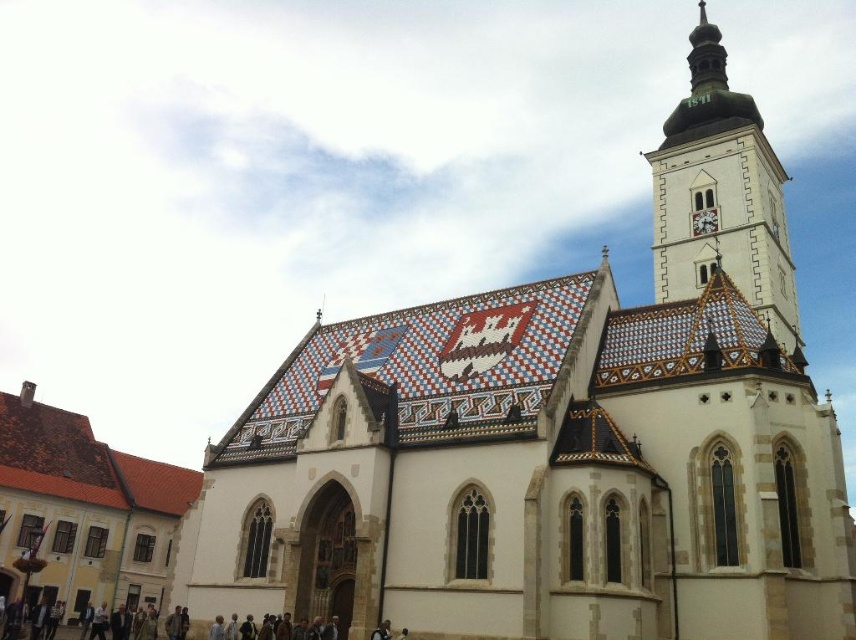
In order to click on white tiled tower at upper right in this screenshot , I will do `click(721, 195)`.

Who is more forward, (738, 168) or (697, 224)?

Point (697, 224)

Find the location of a particular element. The height and width of the screenshot is (640, 856). white tiled tower at upper right is located at coordinates (721, 195).